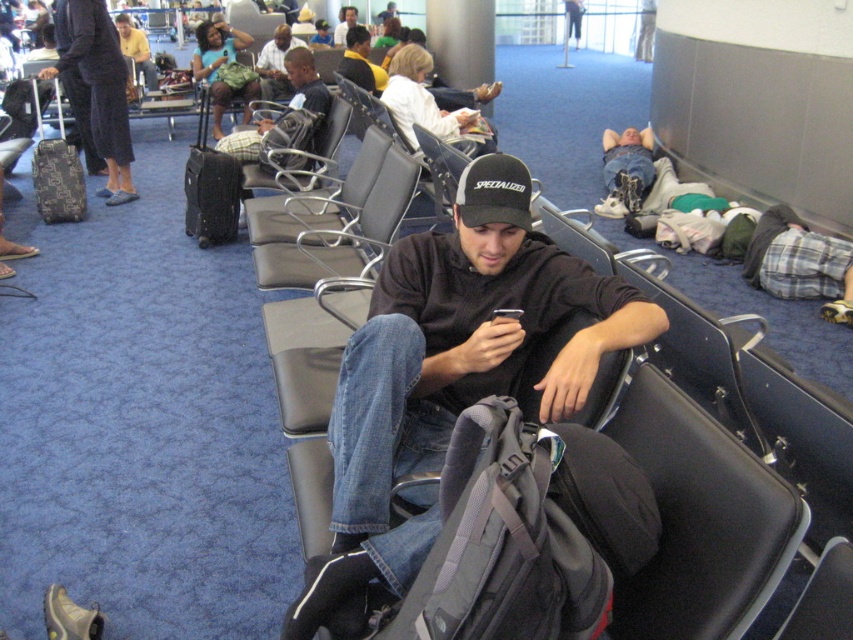
Question: Which object is the farthest from the matte black backpack at center?

Choices:
 (A) black textured suitcase at center
 (B) dark gray hoodie at center

Answer: (B)

Question: Does dark gray hoodie at center have a larger size compared to matte black suitcase at left?

Choices:
 (A) yes
 (B) no

Answer: (B)

Question: Is black textured suitcase at center smaller than patterned fabric suitcase at left?

Choices:
 (A) yes
 (B) no

Answer: (B)

Question: Is dark gray hoodie at center smaller than black textured suitcase at center?

Choices:
 (A) yes
 (B) no

Answer: (B)

Question: Which point is farther to the camera?

Choices:
 (A) (437, 278)
 (B) (244, 138)

Answer: (B)

Question: Which object is the closest to the denim jeans at center?

Choices:
 (A) patterned fabric suitcase at left
 (B) black textured suitcase at center
 (C) matte black suitcase at left

Answer: (B)